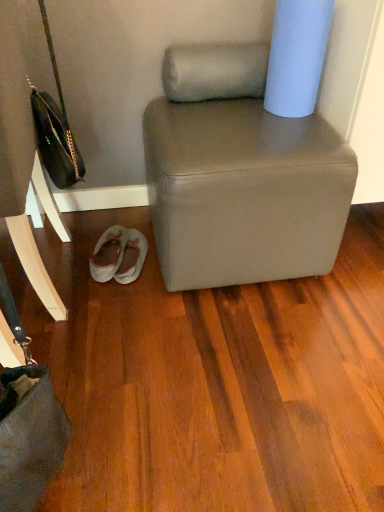
Question: Can you confirm if matte black handbag at left is positioned to the right of leather handbag at left?

Choices:
 (A) yes
 (B) no

Answer: (A)

Question: Can you confirm if matte black handbag at left is taller than leather handbag at left?

Choices:
 (A) yes
 (B) no

Answer: (B)

Question: Can you confirm if matte black handbag at left is wider than leather handbag at left?

Choices:
 (A) no
 (B) yes

Answer: (A)

Question: Does matte black handbag at left have a lesser height compared to leather handbag at left?

Choices:
 (A) no
 (B) yes

Answer: (B)

Question: Is matte black handbag at left bigger than leather handbag at left?

Choices:
 (A) yes
 (B) no

Answer: (B)

Question: In the image, is light blue matte toilet paper at upper right positioned in front of or behind light gray suede slippers at lower left?

Choices:
 (A) behind
 (B) front

Answer: (B)

Question: Would you say light blue matte toilet paper at upper right is inside or outside light gray suede slippers at lower left?

Choices:
 (A) outside
 (B) inside

Answer: (A)

Question: From the image's perspective, relative to light gray suede slippers at lower left, is light blue matte toilet paper at upper right above or below?

Choices:
 (A) above
 (B) below

Answer: (A)

Question: Is point (273, 34) positioned closer to the camera than point (130, 250)?

Choices:
 (A) farther
 (B) closer

Answer: (B)

Question: Is light gray suede slippers at lower left bigger or smaller than matte black handbag at left?

Choices:
 (A) small
 (B) big

Answer: (A)

Question: Looking at their shapes, would you say light gray suede slippers at lower left is wider or thinner than matte black handbag at left?

Choices:
 (A) thin
 (B) wide

Answer: (B)

Question: Is light gray suede slippers at lower left spatially inside matte black handbag at left, or outside of it?

Choices:
 (A) outside
 (B) inside

Answer: (A)

Question: From a real-world perspective, is light gray suede slippers at lower left positioned above or below matte black handbag at left?

Choices:
 (A) below
 (B) above

Answer: (A)

Question: Looking at the image, does light blue matte toilet paper at upper right seem bigger or smaller compared to matte gray ottoman at center?

Choices:
 (A) big
 (B) small

Answer: (B)

Question: From a real-world perspective, is light blue matte toilet paper at upper right above or below matte gray ottoman at center?

Choices:
 (A) above
 (B) below

Answer: (A)